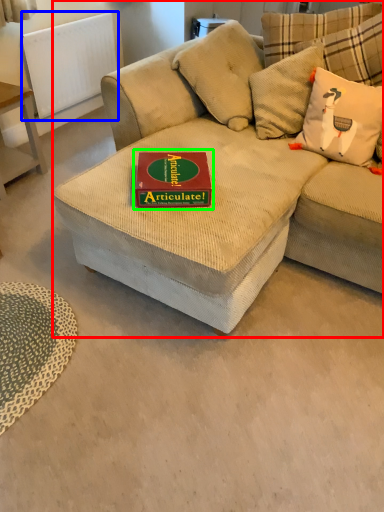
Question: Estimate the real-world distances between objects in this image. Which object is closer to studio couch (highlighted by a red box), radiator (highlighted by a blue box) or paperback book (highlighted by a green box)?

Choices:
 (A) radiator
 (B) paperback book

Answer: (B)